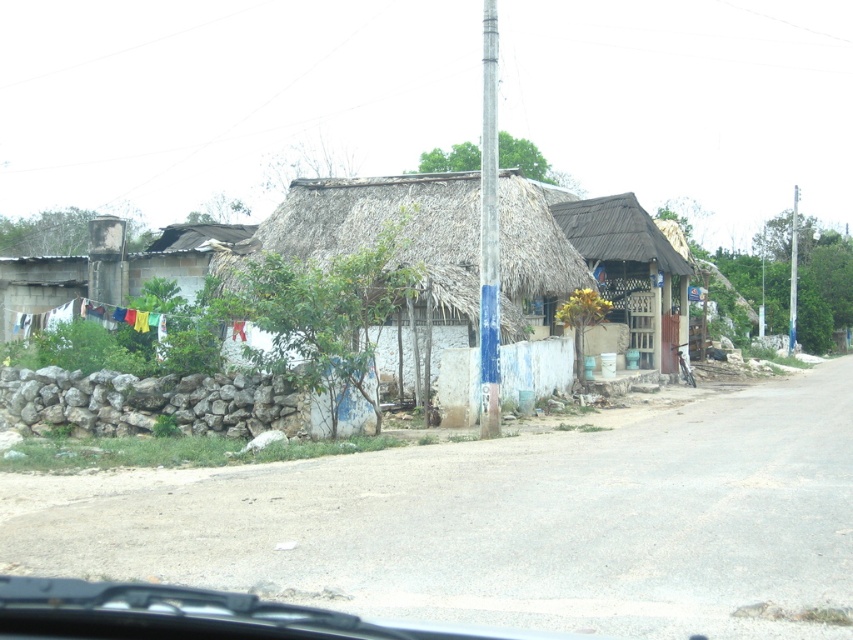
You are standing at the point labeled point (793, 209) and want to walk to the point labeled point (492, 419). According to the scene description, will you be moving towards the road or away from it?

Since point (492, 419) is in front of point (793, 209), moving towards it would mean you are walking towards the road as the structures are along the road.

You are standing at the origin point of the coordinate system. You want to walk to the white thatch hut at center. What direction should you head in?

Since the white thath hut at center is at coordinate point (386, 227), you should head northeast to reach it.